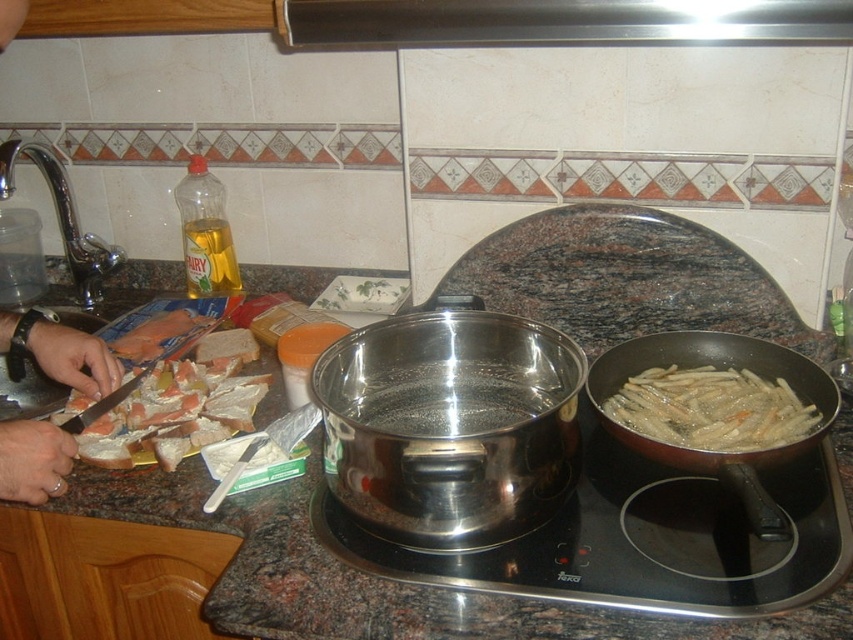
Question: From the image, what is the correct spatial relationship of granite countertop at center in relation to golden crispy fries at right?

Choices:
 (A) above
 (B) below

Answer: (B)

Question: Which object is closer to the camera taking this photo?

Choices:
 (A) shiny silver frying pan at right
 (B) white bread at left
 (C) granite countertop at center
 (D) golden crispy fries at right

Answer: (C)

Question: Which point is farther from the camera taking this photo?

Choices:
 (A) (39, 445)
 (B) (311, 588)

Answer: (A)

Question: Can you confirm if stainless steel pan at center is positioned below metallic stainless steel exhaust hood at upper center?

Choices:
 (A) no
 (B) yes

Answer: (B)

Question: Is golden crispy fries at right thinner than smooth white bread at left?

Choices:
 (A) no
 (B) yes

Answer: (A)

Question: Estimate the real-world distances between objects in this image. Which object is closer to the shiny silver frying pan at right?

Choices:
 (A) stainless steel pan at center
 (B) smooth white bread at left
 (C) metallic stainless steel exhaust hood at upper center

Answer: (A)